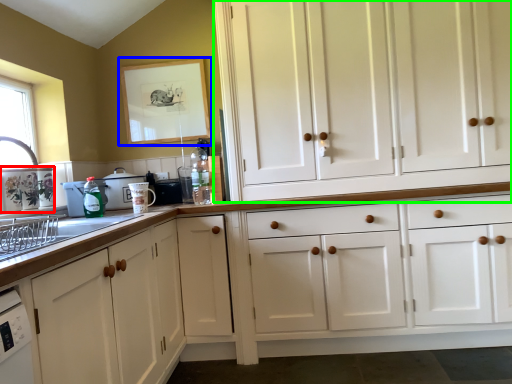
Question: Which object is positioned farthest from appliance (highlighted by a red box)? Select from picture frame (highlighted by a blue box) and cabinetry (highlighted by a green box).

Choices:
 (A) picture frame
 (B) cabinetry

Answer: (B)